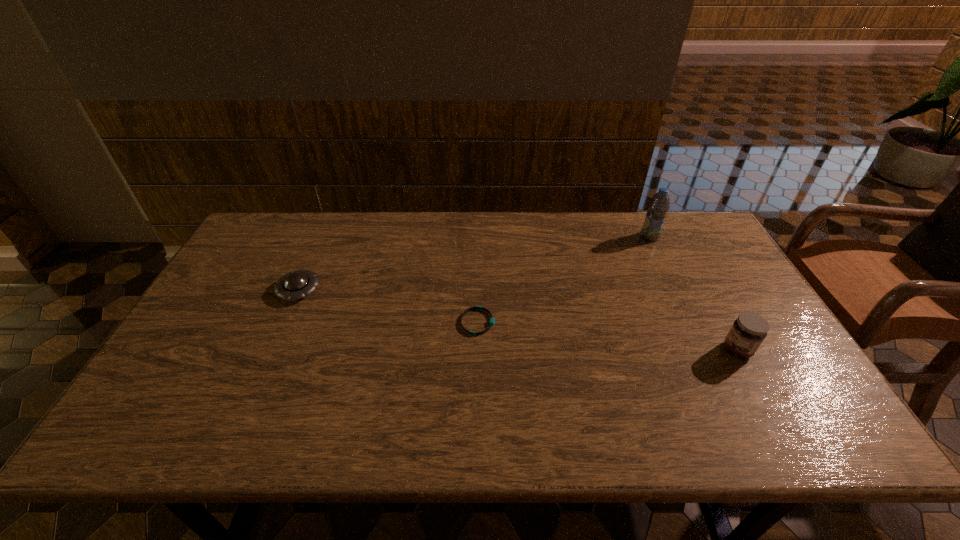
Locate an element on the screen. The width and height of the screenshot is (960, 540). the tallest object is located at coordinates (658, 206).

This screenshot has height=540, width=960. I want to click on the second object from right to left, so click(x=658, y=206).

Locate an element on the screen. This screenshot has height=540, width=960. the rightmost object is located at coordinates (749, 330).

Where is `the third shortest object`? The image size is (960, 540). the third shortest object is located at coordinates (749, 330).

Locate an element on the screen. The height and width of the screenshot is (540, 960). saucer is located at coordinates (297, 284).

Identify the location of the leftmost object. (297, 284).

This screenshot has width=960, height=540. In order to click on the second object from left to right in this screenshot , I will do 492,320.

Image resolution: width=960 pixels, height=540 pixels. I want to click on wristband, so click(492, 320).

Identify the location of vacant space situated 0.060m on the back of the third object from left to right. The width and height of the screenshot is (960, 540). (642, 221).

Where is `free location located on the front label of the jam`? The image size is (960, 540). free location located on the front label of the jam is located at coordinates (614, 350).